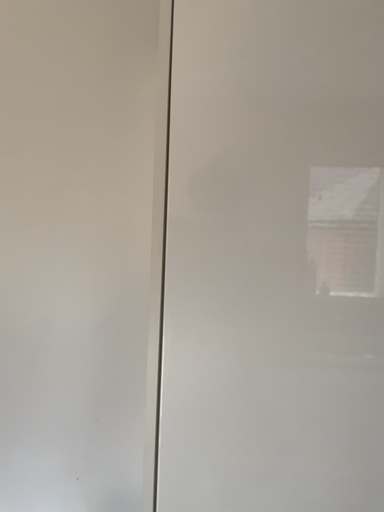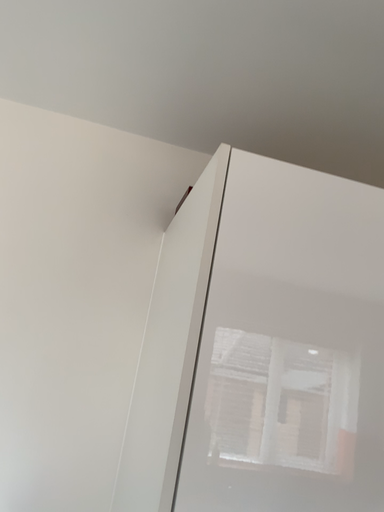
Question: Which way did the camera rotate in the video?

Choices:
 (A) rotated left
 (B) rotated right

Answer: (B)